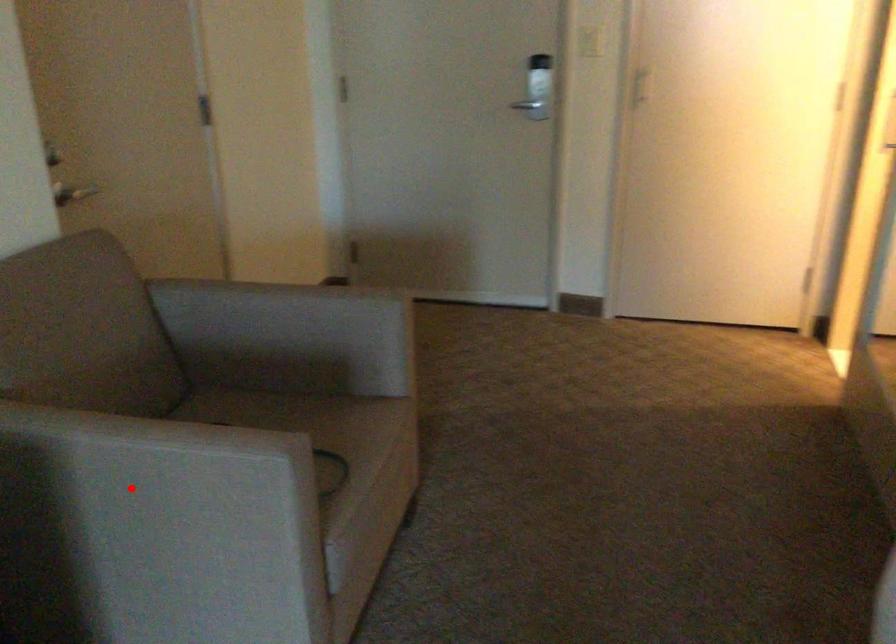
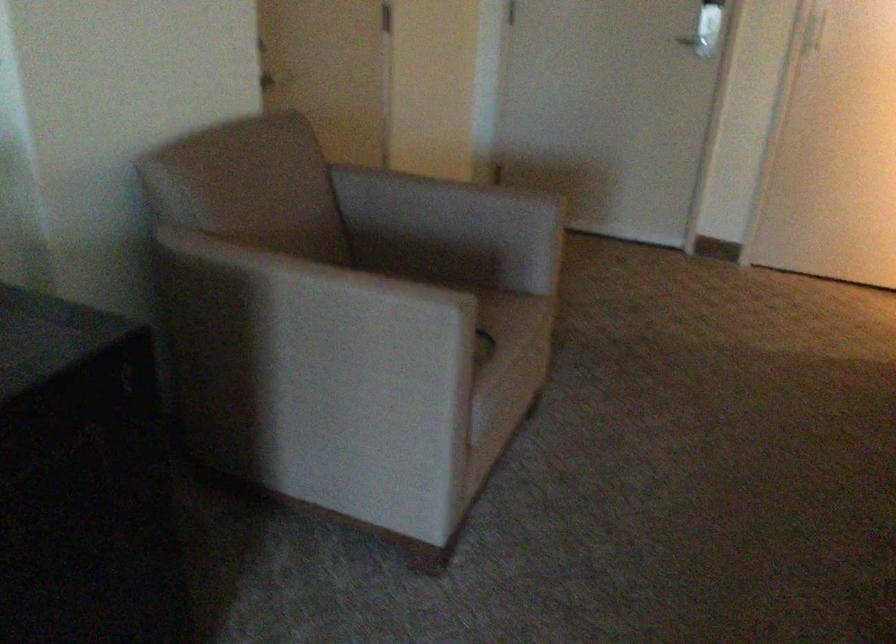
Question: A red point is marked in image1. In image2, is the corresponding 3D point closer to the camera or farther? Reply with the corresponding letter.

Choices:
 (A) The corresponding 3D point is closer.
 (B) The corresponding 3D point is farther.

Answer: (B)